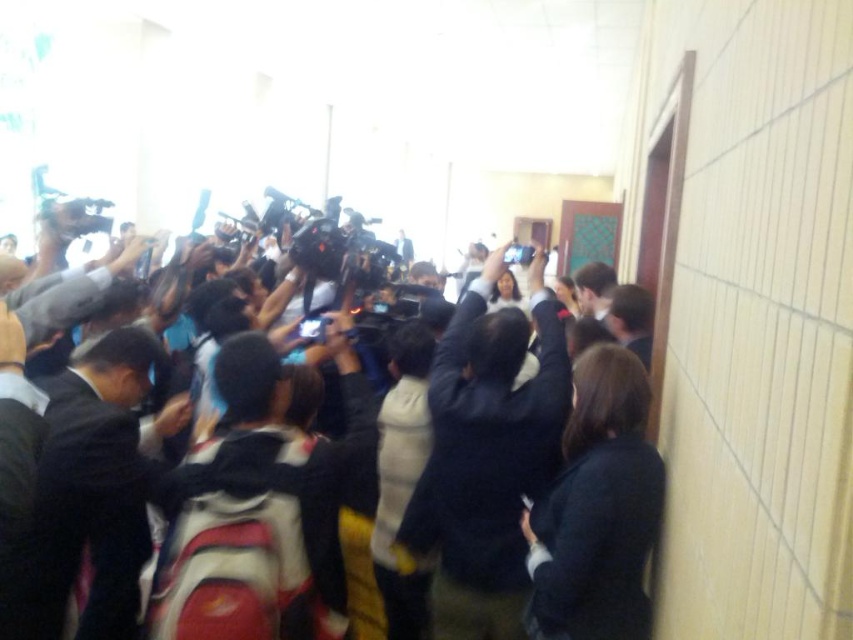
Which of these two, white cotton jacket at center or black fabric crowd at center, stands taller?

Standing taller between the two is white cotton jacket at center.

At what (x,y) coordinates should I click in order to perform the action: click on white cotton jacket at center. Please return your answer as a coordinate pair (x, y). This screenshot has width=853, height=640. Looking at the image, I should click on (486, 456).

You are a GUI agent. You are given a task and a screenshot of the screen. Output one action in this format:
    pyautogui.click(x=<x>, y=<y>)
    Task: Click on the white cotton jacket at center
    Image resolution: width=853 pixels, height=640 pixels.
    Given the screenshot: What is the action you would take?
    pyautogui.click(x=486, y=456)